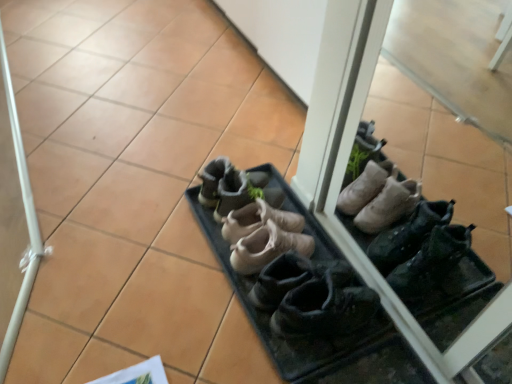
Describe the element at coordinates (323, 310) in the screenshot. I see `black leather shoes at center, acting as the 1th footwear starting from the front` at that location.

Where is `black leather shoes at center, acting as the 1th footwear starting from the front`? The width and height of the screenshot is (512, 384). black leather shoes at center, acting as the 1th footwear starting from the front is located at coordinates (323, 310).

What do you see at coordinates (258, 220) in the screenshot?
I see `leather boots at center, arranged as the second footwear when viewed from the back` at bounding box center [258, 220].

How much space does leather boots at center, arranged as the second footwear when viewed from the back, occupy vertically?

leather boots at center, arranged as the second footwear when viewed from the back, is 5.76 inches tall.

In the scene shown: Measure the distance between point (228, 183) and camera.

Point (228, 183) and camera are 1.37 meters apart.

Measure the distance between leather boots at center, which appears as the first footwear when viewed from the back, and camera.

leather boots at center, which appears as the first footwear when viewed from the back, is 1.31 meters from camera.

What do you see at coordinates (292, 271) in the screenshot? This screenshot has width=512, height=384. I see `leather boots at center, the fourth footwear when ordered from back to front` at bounding box center [292, 271].

I want to click on tan suede shoes at center, the 3th footwear viewed from the front, so click(x=267, y=247).

From the image's perspective, between black leather shoes at center, arranged as the 5th footwear when viewed from the back, and leather boots at center, the 2th footwear in the front-to-back sequence, who is located below?

black leather shoes at center, arranged as the 5th footwear when viewed from the back, is shown below in the image.

Can you confirm if black leather shoes at center, arranged as the 5th footwear when viewed from the back, is positioned to the right of leather boots at center, the 2th footwear in the front-to-back sequence?

Correct, you'll find black leather shoes at center, arranged as the 5th footwear when viewed from the back, to the right of leather boots at center, the 2th footwear in the front-to-back sequence.

Which is nearer, (298,307) or (347,321)?

Point (298,307) is positioned closer to the camera compared to point (347,321).

Does black leather shoes at center, acting as the 1th footwear starting from the front, lie in front of leather boots at center, the 2th footwear in the front-to-back sequence?

Yes, black leather shoes at center, acting as the 1th footwear starting from the front, is in front of leather boots at center, the 2th footwear in the front-to-back sequence.

From the picture: Considering the relative positions of black leather shoes at center, arranged as the 5th footwear when viewed from the back, and leather boots at center, the 5th footwear in the front-to-back sequence, in the image provided, is black leather shoes at center, arranged as the 5th footwear when viewed from the back, to the right of leather boots at center, the 5th footwear in the front-to-back sequence, from the viewer's perspective?

Correct, you'll find black leather shoes at center, arranged as the 5th footwear when viewed from the back, to the right of leather boots at center, the 5th footwear in the front-to-back sequence.

Is point (309, 316) positioned before point (229, 208)?

Yes, it is in front of point (229, 208).

Who is smaller, black leather shoes at center, acting as the 1th footwear starting from the front, or leather boots at center, which appears as the first footwear when viewed from the back?

leather boots at center, which appears as the first footwear when viewed from the back.

Is tan suede shoes at center, the 3th footwear viewed from the front, aimed at black leather shoes at center, arranged as the 5th footwear when viewed from the back?

No, tan suede shoes at center, the 3th footwear viewed from the front, is not oriented towards black leather shoes at center, arranged as the 5th footwear when viewed from the back.

From a real-world perspective, which object stands above the other?

In real-world perspective, black leather shoes at center, arranged as the 5th footwear when viewed from the back, is above.

Between point (246, 239) and point (326, 328), which one is positioned in front?

The point (326, 328) is more forward.

From the image's perspective, is leather boots at center, which appears as the first footwear when viewed from the back, above or below leather boots at center, the fourth footwear when ordered from back to front?

leather boots at center, which appears as the first footwear when viewed from the back, is above leather boots at center, the fourth footwear when ordered from back to front.

In the scene shown: Is leather boots at center, the 2th footwear in the front-to-back sequence, completely or partially inside leather boots at center, which appears as the first footwear when viewed from the back?

Definitely not — leather boots at center, the 2th footwear in the front-to-back sequence, is not inside leather boots at center, which appears as the first footwear when viewed from the back.

Looking at this image, based on their positions, is leather boots at center, which appears as the first footwear when viewed from the back, located to the left or right of leather boots at center, the fourth footwear when ordered from back to front?

In the image, leather boots at center, which appears as the first footwear when viewed from the back, appears on the left side of leather boots at center, the fourth footwear when ordered from back to front.

Considering their positions, is leather boots at center, the 5th footwear in the front-to-back sequence, located in front of or behind leather boots at center, the fourth footwear when ordered from back to front?

leather boots at center, the 5th footwear in the front-to-back sequence, is positioned farther from the viewer than leather boots at center, the fourth footwear when ordered from back to front.

In terms of width, does tan suede shoes at center, the 3th footwear viewed from the front, look wider or thinner when compared to leather boots at center, the 2th footwear in the front-to-back sequence?

Considering their sizes, tan suede shoes at center, the 3th footwear viewed from the front, looks slimmer than leather boots at center, the 2th footwear in the front-to-back sequence.

In the scene shown: Is tan suede shoes at center, the 3th footwear viewed from the front, inside or outside of leather boots at center, the 2th footwear in the front-to-back sequence?

tan suede shoes at center, the 3th footwear viewed from the front, is not enclosed by leather boots at center, the 2th footwear in the front-to-back sequence.

Considering the sizes of objects tan suede shoes at center, which ranks as the 3th footwear in back-to-front order, and leather boots at center, the 2th footwear in the front-to-back sequence, in the image provided, who is smaller, tan suede shoes at center, which ranks as the 3th footwear in back-to-front order, or leather boots at center, the 2th footwear in the front-to-back sequence,?

tan suede shoes at center, which ranks as the 3th footwear in back-to-front order, is smaller.

From a real-world perspective, who is located lower, tan suede shoes at center, the 3th footwear viewed from the front, or leather boots at center, the 2th footwear in the front-to-back sequence?

leather boots at center, the 2th footwear in the front-to-back sequence, is physically lower.

Between leather boots at center, the 5th footwear in the front-to-back sequence, and tan suede shoes at center, which ranks as the 3th footwear in back-to-front order, which one is positioned in front?

tan suede shoes at center, which ranks as the 3th footwear in back-to-front order, is in front.

From a real-world perspective, is leather boots at center, which appears as the first footwear when viewed from the back, on top of tan suede shoes at center, which ranks as the 3th footwear in back-to-front order?

Yes, from a real-world perspective, leather boots at center, which appears as the first footwear when viewed from the back, is on top of tan suede shoes at center, which ranks as the 3th footwear in back-to-front order.

From the picture: Is leather boots at center, which appears as the first footwear when viewed from the back, surrounding tan suede shoes at center, which ranks as the 3th footwear in back-to-front order?

No, tan suede shoes at center, which ranks as the 3th footwear in back-to-front order, is located outside of leather boots at center, which appears as the first footwear when viewed from the back.

Relative to leather boots at center, the fourth footwear viewed from the front, is leather boots at center, the fourth footwear when ordered from back to front, in front or behind?

In the image, leather boots at center, the fourth footwear when ordered from back to front, appears in front of leather boots at center, the fourth footwear viewed from the front.

Considering the points (360, 312) and (247, 226), which point is behind, point (360, 312) or point (247, 226)?

The point (247, 226) is farther from the camera.

Does leather boots at center, the 2th footwear in the front-to-back sequence, appear on the left side of leather boots at center, the fourth footwear viewed from the front?

No, leather boots at center, the 2th footwear in the front-to-back sequence, is not to the left of leather boots at center, the fourth footwear viewed from the front.

From the image's perspective, between leather boots at center, the fourth footwear when ordered from back to front, and leather boots at center, the fourth footwear viewed from the front, which one is located above?

leather boots at center, the fourth footwear viewed from the front, is shown above in the image.

The height and width of the screenshot is (384, 512). Identify the location of the 1st footwear behind the black leather shoes at center, acting as the 1th footwear starting from the front, starting your count from the anchor. (292, 271).

Image resolution: width=512 pixels, height=384 pixels. Identify the location of the 4th footwear to the right of the leather boots at center, the 5th footwear in the front-to-back sequence, counting from the anchor's position. (323, 310).

When comparing their distances from black leather shoes at center, acting as the 1th footwear starting from the front, does leather boots at center, which appears as the first footwear when viewed from the back, or leather boots at center, the fourth footwear viewed from the front, seem closer?

Based on the image, leather boots at center, the fourth footwear viewed from the front, appears to be nearer to black leather shoes at center, acting as the 1th footwear starting from the front.

Based on the photo, considering their positions, is leather boots at center, the fourth footwear viewed from the front, positioned closer to black leather shoes at center, acting as the 1th footwear starting from the front, than tan suede shoes at center, which ranks as the 3th footwear in back-to-front order?

The object closer to black leather shoes at center, acting as the 1th footwear starting from the front, is tan suede shoes at center, which ranks as the 3th footwear in back-to-front order.

Based on the photo, based on their spatial positions, is leather boots at center, the fourth footwear when ordered from back to front, or tan suede shoes at center, which ranks as the 3th footwear in back-to-front order, further from leather boots at center, which appears as the first footwear when viewed from the back?

leather boots at center, the fourth footwear when ordered from back to front.

Estimate the real-world distances between objects in this image. Which object is closer to black leather shoes at center, acting as the 1th footwear starting from the front, leather boots at center, the fourth footwear when ordered from back to front, or tan suede shoes at center, which ranks as the 3th footwear in back-to-front order?

leather boots at center, the fourth footwear when ordered from back to front.

Based on their spatial positions, is leather boots at center, arranged as the second footwear when viewed from the back, or leather boots at center, the 2th footwear in the front-to-back sequence, further from leather boots at center, which appears as the first footwear when viewed from the back?

leather boots at center, the 2th footwear in the front-to-back sequence, lies further to leather boots at center, which appears as the first footwear when viewed from the back, than the other object.

Estimate the real-world distances between objects in this image. Which object is closer to leather boots at center, the 2th footwear in the front-to-back sequence, tan suede shoes at center, the 3th footwear viewed from the front, or leather boots at center, arranged as the second footwear when viewed from the back?

tan suede shoes at center, the 3th footwear viewed from the front, is closer to leather boots at center, the 2th footwear in the front-to-back sequence.

Which object lies further to the anchor point leather boots at center, the 2th footwear in the front-to-back sequence, leather boots at center, which appears as the first footwear when viewed from the back, or leather boots at center, arranged as the second footwear when viewed from the back?

Based on the image, leather boots at center, which appears as the first footwear when viewed from the back, appears to be further to leather boots at center, the 2th footwear in the front-to-back sequence.

Looking at the image, which one is located further to tan suede shoes at center, which ranks as the 3th footwear in back-to-front order, leather boots at center, arranged as the second footwear when viewed from the back, or black leather shoes at center, arranged as the 5th footwear when viewed from the back?

black leather shoes at center, arranged as the 5th footwear when viewed from the back, lies further to tan suede shoes at center, which ranks as the 3th footwear in back-to-front order, than the other object.

You are a GUI agent. You are given a task and a screenshot of the screen. Output one action in this format:
    pyautogui.click(x=<x>, y=<y>)
    Task: Click on the footwear between black leather shoes at center, acting as the 1th footwear starting from the front, and tan suede shoes at center, which ranks as the 3th footwear in back-to-front order, in the front-back direction
    
    Given the screenshot: What is the action you would take?
    pyautogui.click(x=292, y=271)

This screenshot has height=384, width=512. I want to click on footwear that lies between leather boots at center, which appears as the first footwear when viewed from the back, and tan suede shoes at center, which ranks as the 3th footwear in back-to-front order, from top to bottom, so click(258, 220).

Locate an element on the screen. footwear located between leather boots at center, the 2th footwear in the front-to-back sequence, and leather boots at center, the fourth footwear viewed from the front, in the depth direction is located at coordinates (267, 247).